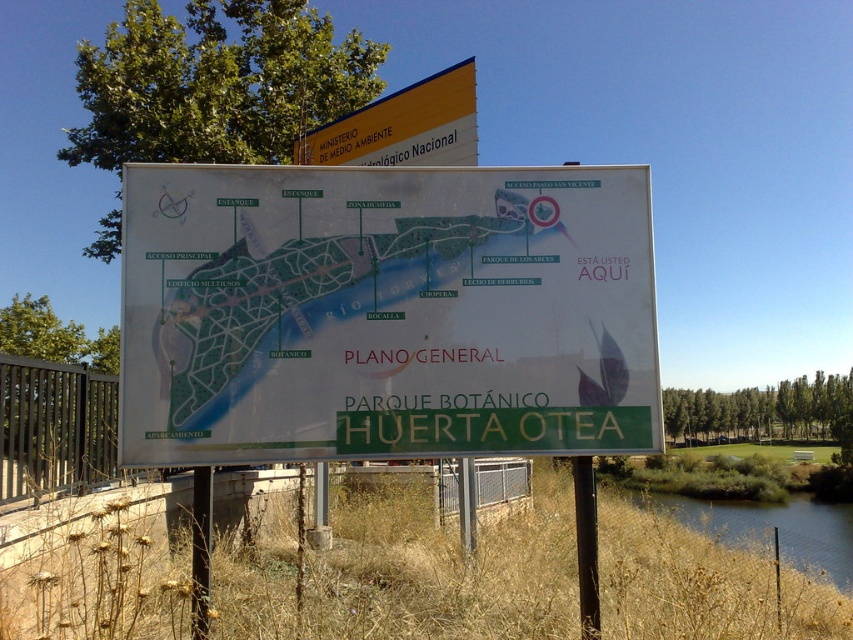
Question: Considering the relative positions of white paper map at center and yellow plastic sign at upper center in the image provided, where is white paper map at center located with respect to yellow plastic sign at upper center?

Choices:
 (A) below
 (B) above

Answer: (A)

Question: Estimate the real-world distances between objects in this image. Which object is closer to the green grassy river at lower right?

Choices:
 (A) white paper map at center
 (B) yellow plastic sign at upper center

Answer: (A)

Question: Can you confirm if white paper map at center is positioned above green grassy river at lower right?

Choices:
 (A) yes
 (B) no

Answer: (A)

Question: Which point is closer to the camera?

Choices:
 (A) green grassy river at lower right
 (B) white paper map at center
 (C) yellow plastic sign at upper center

Answer: (B)

Question: Does white paper map at center have a lesser width compared to green grassy river at lower right?

Choices:
 (A) yes
 (B) no

Answer: (A)

Question: Based on their relative distances, which object is nearer to the white paper map at center?

Choices:
 (A) yellow plastic sign at upper center
 (B) green grassy river at lower right

Answer: (A)